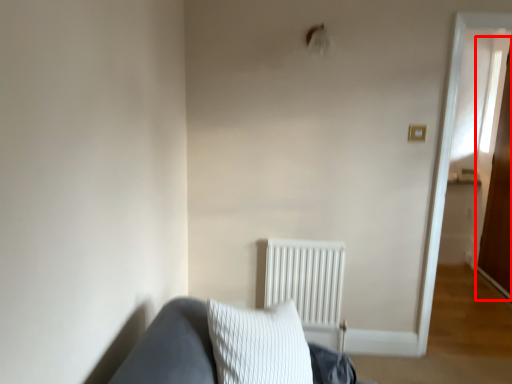
Question: From the image's perspective, what is the correct spatial relationship of glass door (annotated by the red box) in relation to radiator?

Choices:
 (A) below
 (B) above

Answer: (B)